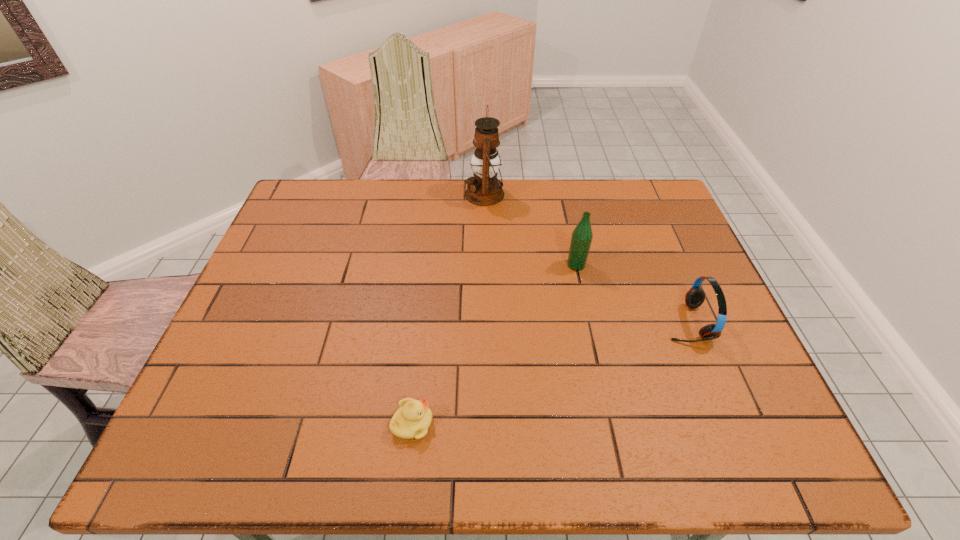
Where is `vacant space at the near edge of the desktop`? This screenshot has height=540, width=960. vacant space at the near edge of the desktop is located at coordinates (630, 441).

In order to click on free point at the left edge in this screenshot , I will do [x=220, y=371].

This screenshot has width=960, height=540. In order to click on vacant area at the right edge of the desktop in this screenshot , I will do `click(682, 258)`.

In the image, there is a desktop. In order to click on free space at the far right corner in this screenshot , I will do `click(644, 221)`.

I want to click on vacant space that's between the leftmost object and the second object from right to left, so click(x=494, y=344).

At what (x,y) coordinates should I click in order to perform the action: click on empty space between the farthest object and the second object from right to left. Please return your answer as a coordinate pair (x, y). The height and width of the screenshot is (540, 960). Looking at the image, I should click on (530, 230).

This screenshot has height=540, width=960. Identify the location of unoccupied area between the leftmost object and the third farthest object. (549, 373).

Image resolution: width=960 pixels, height=540 pixels. I want to click on empty location between the leftmost object and the lantern, so (448, 309).

The image size is (960, 540). Identify the location of free space between the third tallest object and the leftmost object. (549, 373).

At what (x,y) coordinates should I click in order to perform the action: click on empty space that is in between the lantern and the leftmost object. Please return your answer as a coordinate pair (x, y). The image size is (960, 540). Looking at the image, I should click on (448, 309).